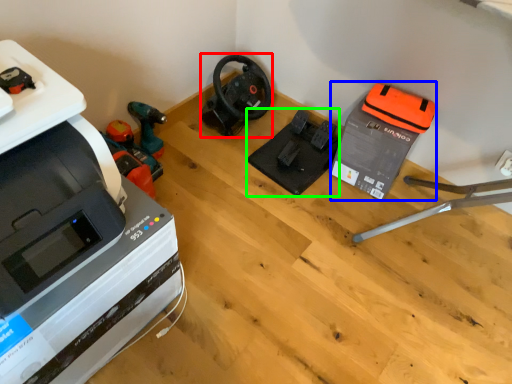
Question: Which is farther away from vacuum (highlighted by a red box)? equipment (highlighted by a blue box) or equipment (highlighted by a green box)?

Choices:
 (A) equipment
 (B) equipment

Answer: (A)